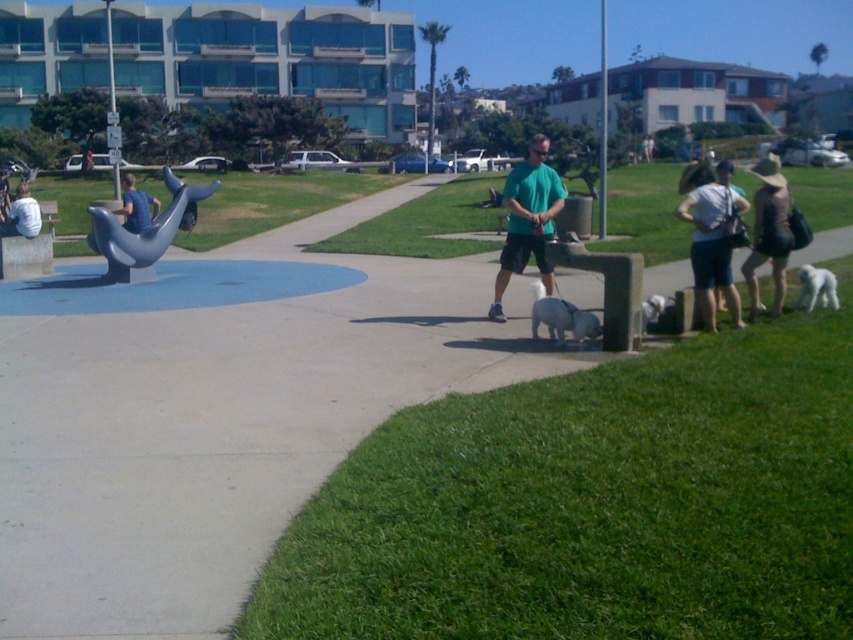
Does point (112, 280) lie in front of point (788, 204)?

No, it is behind (788, 204).

Can you confirm if shiny metallic dolphin at left is positioned to the left of camouflage fabric hat at right?

Indeed, shiny metallic dolphin at left is positioned on the left side of camouflage fabric hat at right.

Between point (193, 211) and point (770, 205), which one is positioned in front?

Point (770, 205)

In order to click on shiny metallic dolphin at left in this screenshot , I will do `click(144, 230)`.

From the picture: Who is positioned more to the left, white fluffy dog at lower right or blue fabric shirt at left?

blue fabric shirt at left is more to the left.

Is white fluffy dog at lower right below blue fabric shirt at left?

Indeed, white fluffy dog at lower right is positioned under blue fabric shirt at left.

Which is in front, point (831, 305) or point (138, 189)?

Point (831, 305) is more forward.

Locate an element on the screen. white fluffy dog at lower right is located at coordinates (816, 289).

Is point (706, 173) in front of point (541, 285)?

No.

Is denim shorts at lower right positioned at the back of white fluffy dog at center?

Yes, it is behind white fluffy dog at center.

The height and width of the screenshot is (640, 853). In order to click on denim shorts at lower right in this screenshot , I will do `click(711, 237)`.